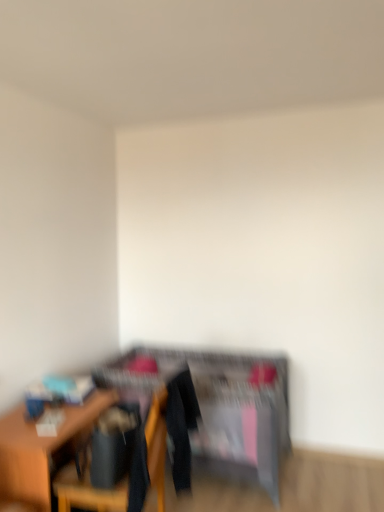
Question: From the image's perspective, is wooden chair at lower left on wooden dresser at center?

Choices:
 (A) yes
 (B) no

Answer: (A)

Question: Is wooden dresser at center completely or partially inside wooden chair at lower left?

Choices:
 (A) yes
 (B) no

Answer: (B)

Question: Is wooden chair at lower left smaller than wooden dresser at center?

Choices:
 (A) no
 (B) yes

Answer: (B)

Question: Is wooden chair at lower left located outside wooden dresser at center?

Choices:
 (A) yes
 (B) no

Answer: (A)

Question: Is wooden chair at lower left behind wooden dresser at center?

Choices:
 (A) yes
 (B) no

Answer: (B)

Question: In terms of height, does wooden chair at lower left look taller or shorter compared to wooden dresser at center?

Choices:
 (A) short
 (B) tall

Answer: (A)

Question: Considering the relative positions of wooden chair at lower left and wooden dresser at center in the image provided, is wooden chair at lower left to the left or to the right of wooden dresser at center?

Choices:
 (A) left
 (B) right

Answer: (A)

Question: From the image's perspective, is wooden chair at lower left above or below wooden dresser at center?

Choices:
 (A) below
 (B) above

Answer: (B)

Question: In the image, is wooden chair at lower left positioned in front of or behind wooden dresser at center?

Choices:
 (A) behind
 (B) front

Answer: (B)

Question: Is wooden table at left taller or shorter than wooden dresser at center?

Choices:
 (A) short
 (B) tall

Answer: (A)

Question: Is wooden table at left to the left or to the right of wooden dresser at center in the image?

Choices:
 (A) left
 (B) right

Answer: (A)

Question: Considering the positions of wooden table at left and wooden dresser at center in the image, is wooden table at left bigger or smaller than wooden dresser at center?

Choices:
 (A) small
 (B) big

Answer: (A)

Question: From a real-world perspective, is wooden table at left physically located above or below wooden dresser at center?

Choices:
 (A) below
 (B) above

Answer: (A)

Question: Based on their positions, is wooden dresser at center located to the left or right of wooden chair at lower left?

Choices:
 (A) right
 (B) left

Answer: (A)

Question: From a real-world perspective, is wooden dresser at center positioned above or below wooden chair at lower left?

Choices:
 (A) above
 (B) below

Answer: (B)